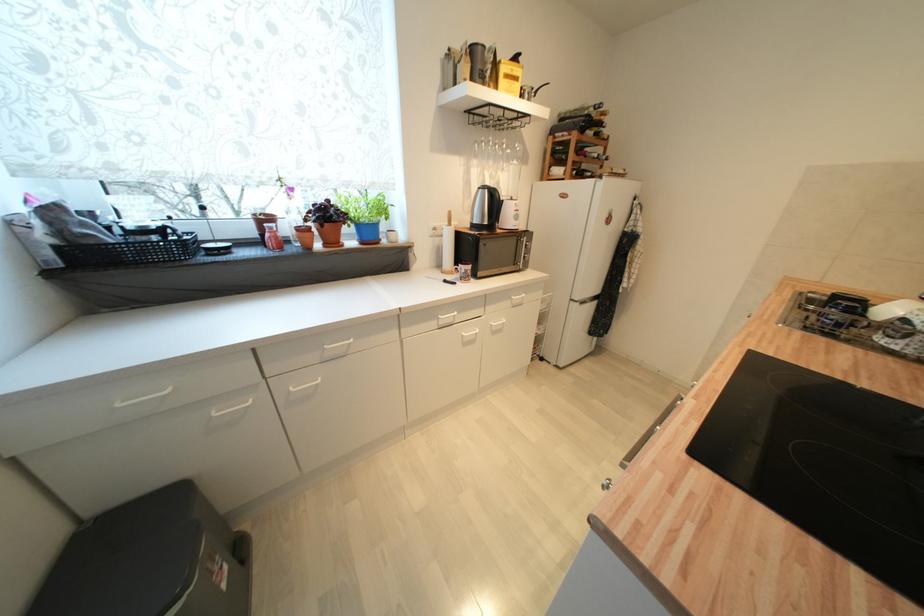
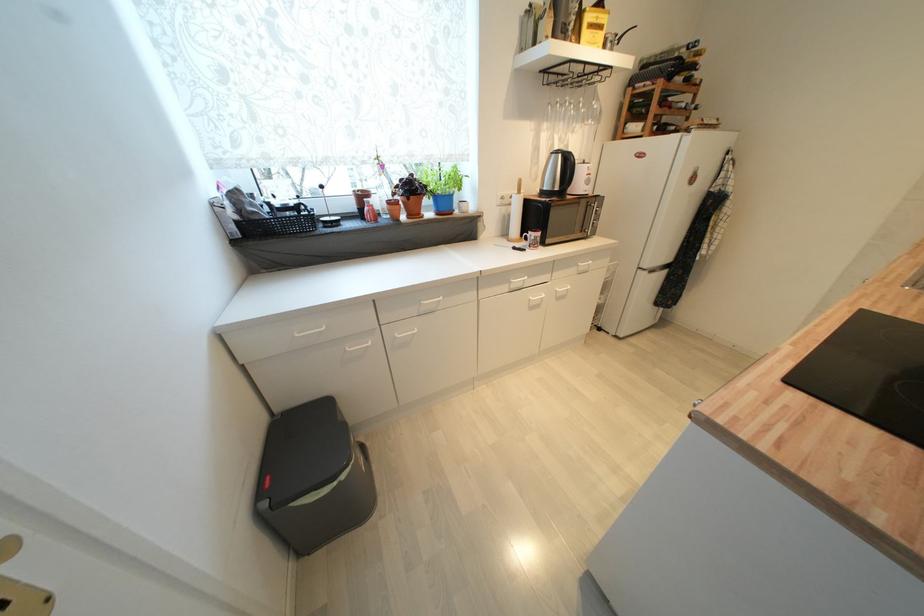
The point at (x=337, y=244) is marked in the first image. Where is the corresponding point in the second image?

(419, 216)